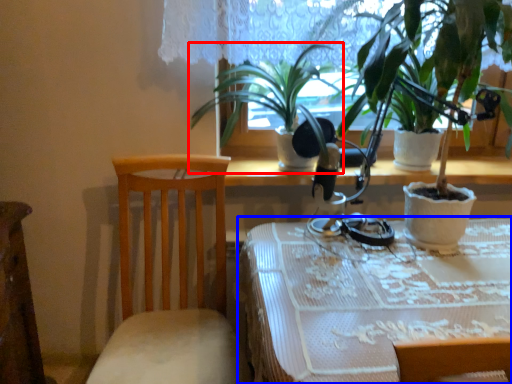
Question: Which of the following is the closest to the observer, houseplant (highlighted by a red box) or table (highlighted by a blue box)?

Choices:
 (A) houseplant
 (B) table

Answer: (B)